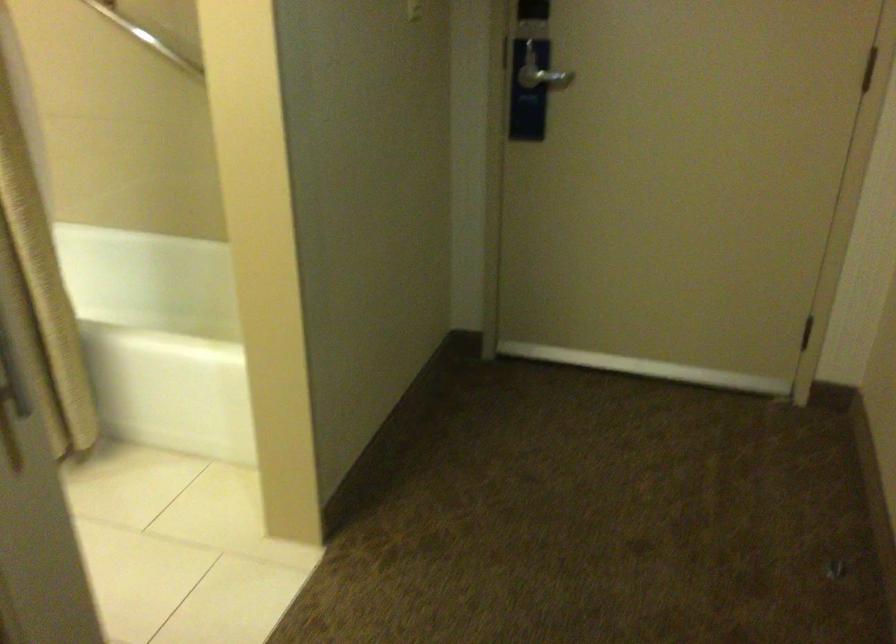
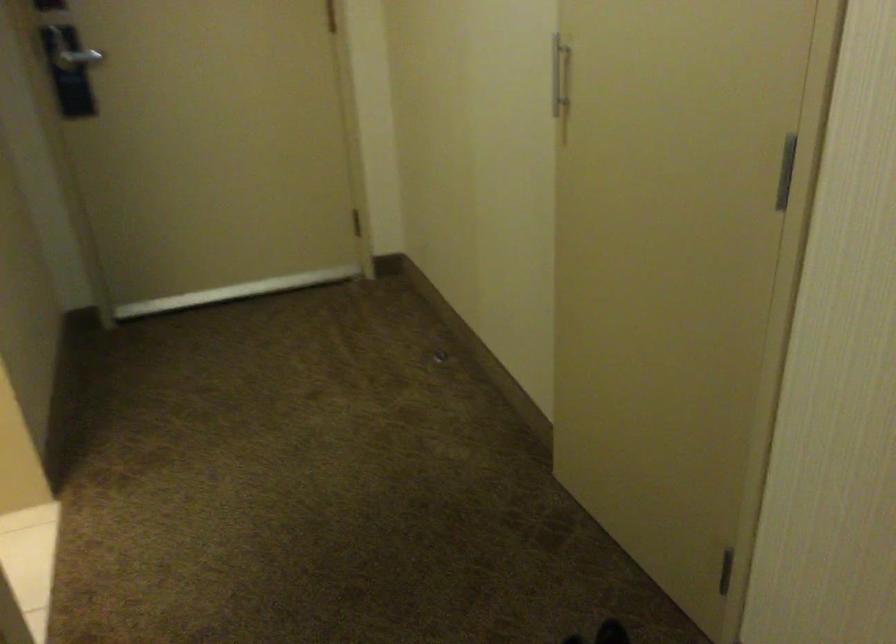
Locate, in the second image, the point that corresponds to (x=536, y=73) in the first image.

(73, 53)